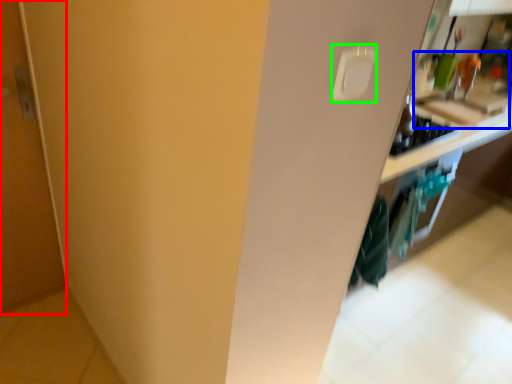
Question: Which object is the closest to the door (highlighted by a red box)? Choose among these: sink (highlighted by a blue box) or light switch (highlighted by a green box).

Choices:
 (A) sink
 (B) light switch

Answer: (B)